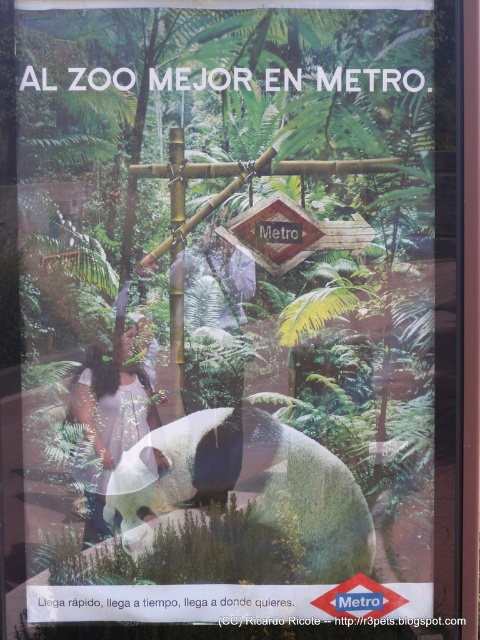
You are standing at the entrance of the metro station and see the white fur panda at center in the advertisement. If you want to reach the zoo, which direction should you go based on the panda and the signpost?

The white fur panda at center is facing the signpost with arrows pointing to the right, so you should go in the direction the arrows indicate to reach the zoo.

You are a photographer trying to capture both the white fur panda at center and the white cotton dress at lower left in a single frame. Which object should you focus on first to ensure both are in the frame?

You should focus on the white fur panda at center first because it has a larger size compared to the white cotton dress at lower left, so it will take up more space in the frame and ensure both are included.